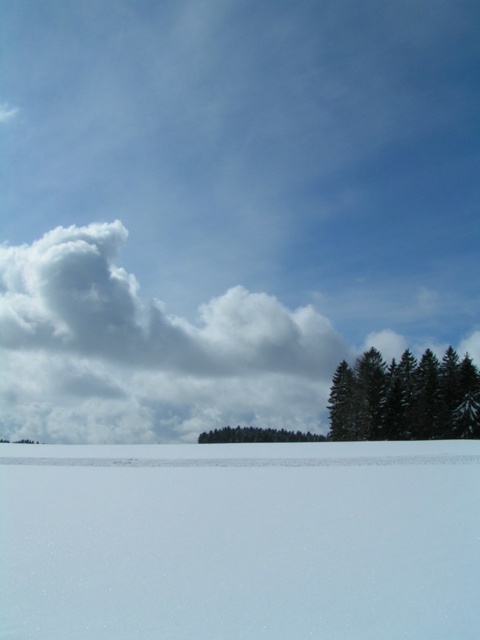
You are standing in the winter landscape and want to place a small snowman exactly at the center of the image. Is the white smooth snow at bottom suitable for building the snowman there?

The white smooth snow at bottom is located at point (240, 540), which is near the bottom of the image. Since the center of the image is at point (240, 320), the snow at the bottom is not at the center. Therefore, the white smooth snow at bottom is not suitable for building the snowman at the exact center.

From the picture: You are standing in the snowy field and see the green matte trees at lower right and the green matte trees at center. Which group of trees appears closer to you?

The green matte trees at lower right appear closer because they are positioned above the green matte trees at center, which is a visual cue indicating depth where objects higher in the image are nearer to the viewer.

You are standing in the winter landscape and want to take a photo of the green matte trees at center without the white smooth snow at bottom appearing in the foreground. Is this possible?

The white smooth snow at bottom is closer to the viewer than the green matte trees at center, so it will block the view of the trees. Therefore, it is not possible to take a photo of the green matte trees at center without the white smooth snow at bottom appearing in the foreground.